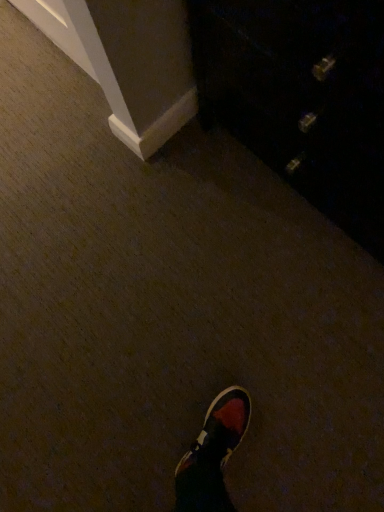
Image resolution: width=384 pixels, height=512 pixels. What do you see at coordinates (302, 97) in the screenshot?
I see `dark wood dresser at upper right` at bounding box center [302, 97].

Image resolution: width=384 pixels, height=512 pixels. Identify the location of dark wood dresser at upper right. (302, 97).

At what (x,y) coordinates should I click in order to perform the action: click on dark wood dresser at upper right. Please return your answer as a coordinate pair (x, y). This screenshot has width=384, height=512. Looking at the image, I should click on click(302, 97).